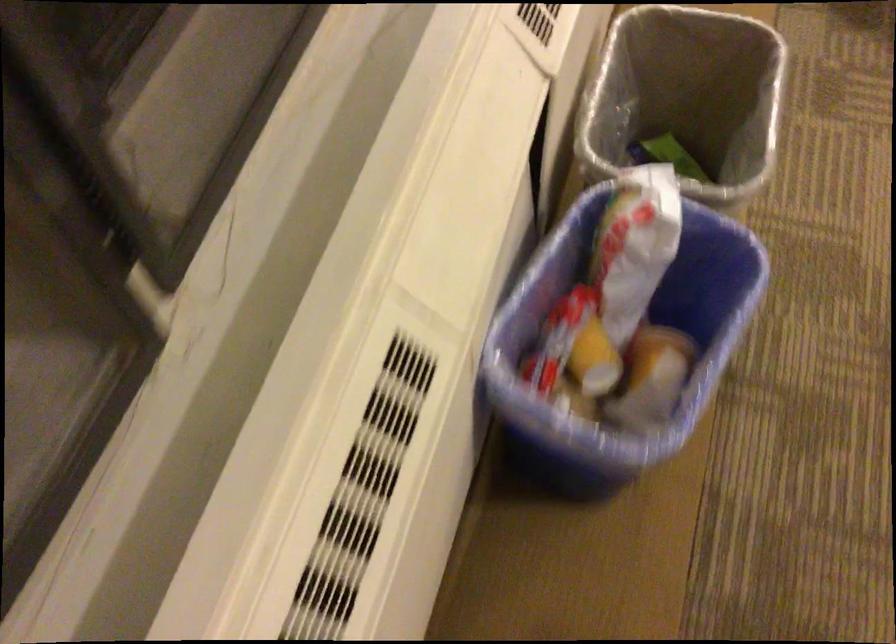
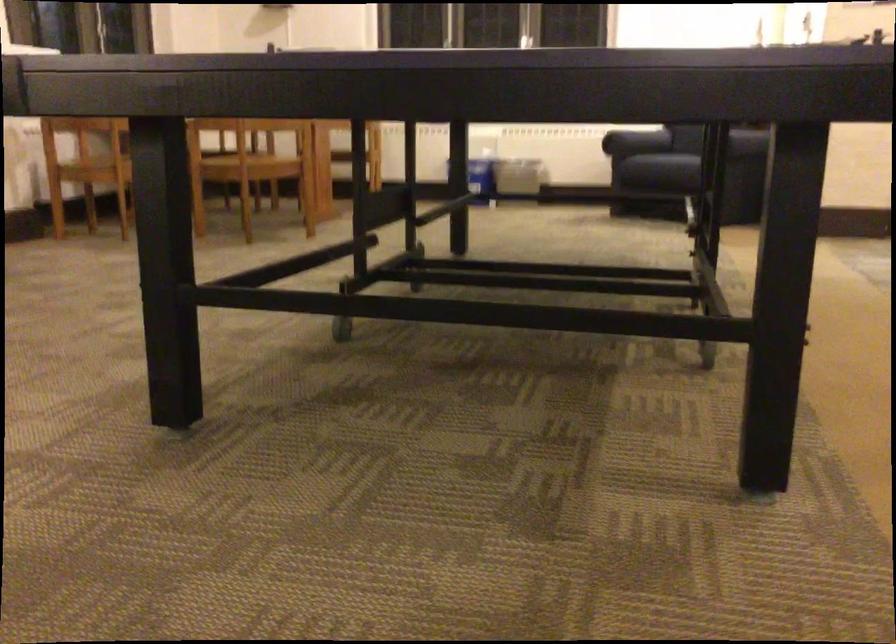
Question: I am providing you with two images of the same scene from different viewpoints. Please identify which objects are invisible in image2.

Choices:
 (A) sofa sitting surface
 (B) chair sitting surface
 (C) blue recycling bin
 (D) dark leather sandal

Answer: (C)